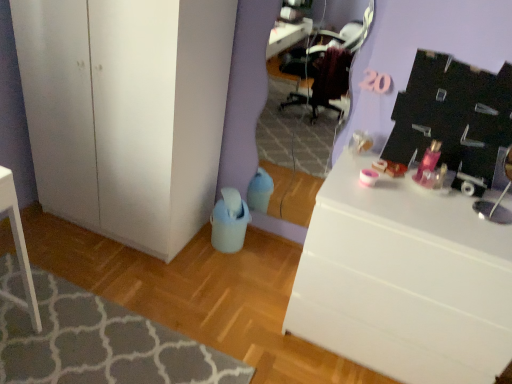
Question: Is white matte cabinet at lower left taller than textured gray rug at lower left?

Choices:
 (A) yes
 (B) no

Answer: (A)

Question: Can you confirm if white matte cabinet at lower left is wider than textured gray rug at lower left?

Choices:
 (A) yes
 (B) no

Answer: (B)

Question: Is white matte cabinet at lower left thinner than textured gray rug at lower left?

Choices:
 (A) no
 (B) yes

Answer: (B)

Question: Is white matte cabinet at lower left turned away from textured gray rug at lower left?

Choices:
 (A) yes
 (B) no

Answer: (B)

Question: From the image's perspective, is white matte cabinet at lower left above textured gray rug at lower left?

Choices:
 (A) no
 (B) yes

Answer: (B)

Question: Is white matte cabinet at lower left in front of textured gray rug at lower left?

Choices:
 (A) no
 (B) yes

Answer: (A)

Question: From the image's perspective, is textured gray rug at lower left on top of matte purple mirror at center?

Choices:
 (A) no
 (B) yes

Answer: (A)

Question: From a real-world perspective, is textured gray rug at lower left on top of matte purple mirror at center?

Choices:
 (A) no
 (B) yes

Answer: (A)

Question: From a real-world perspective, does textured gray rug at lower left sit lower than matte purple mirror at center?

Choices:
 (A) no
 (B) yes

Answer: (B)

Question: Is there a large distance between textured gray rug at lower left and matte purple mirror at center?

Choices:
 (A) yes
 (B) no

Answer: (A)

Question: Is textured gray rug at lower left taller than matte purple mirror at center?

Choices:
 (A) no
 (B) yes

Answer: (A)

Question: Does textured gray rug at lower left appear on the left side of matte purple mirror at center?

Choices:
 (A) yes
 (B) no

Answer: (A)

Question: Is matte purple mirror at center taller than textured gray rug at lower left?

Choices:
 (A) yes
 (B) no

Answer: (A)